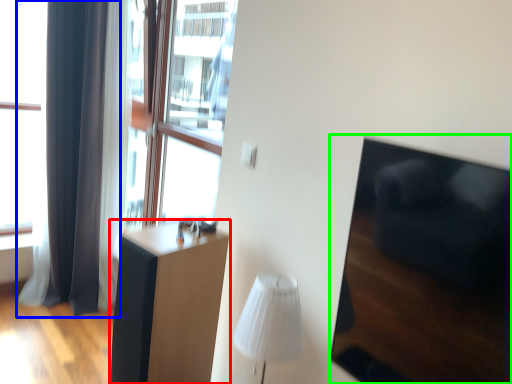
Question: Based on their relative distances, which object is farther from furniture (highlighted by a red box)? Choose from curtain (highlighted by a blue box) and armchair (highlighted by a green box).

Choices:
 (A) curtain
 (B) armchair

Answer: (A)